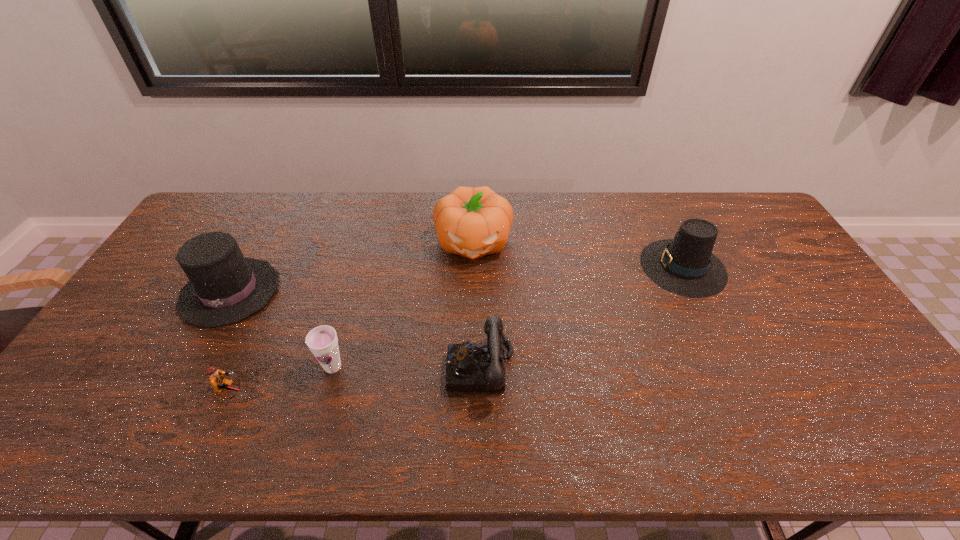
Find the location of a particular element. free spot located on the front-facing side of the rightmost object is located at coordinates (557, 267).

Where is `free space located 0.350m on the dial of the telephone`? Image resolution: width=960 pixels, height=540 pixels. free space located 0.350m on the dial of the telephone is located at coordinates (311, 368).

Identify the location of vacant point located 0.060m on the dial of the telephone. This screenshot has width=960, height=540. (423, 368).

Find the location of a particular element. The image size is (960, 540). vacant space situated 0.370m on the dial of the telephone is located at coordinates [303, 368].

Find the location of a particular element. The height and width of the screenshot is (540, 960). vacant space situated 0.080m on the front of the fourth object from right to left is located at coordinates (322, 408).

The width and height of the screenshot is (960, 540). Find the location of `vacant space located holding a crossbow in the hands of the Lego`. vacant space located holding a crossbow in the hands of the Lego is located at coordinates (371, 390).

Locate an element on the screen. The image size is (960, 540). object that is at the far edge is located at coordinates (472, 222).

Where is `object at the left edge`? object at the left edge is located at coordinates (224, 288).

The image size is (960, 540). Identify the location of vacant space at the far edge. (320, 200).

Where is `vacant space at the near edge of the desktop`? This screenshot has width=960, height=540. vacant space at the near edge of the desktop is located at coordinates (685, 425).